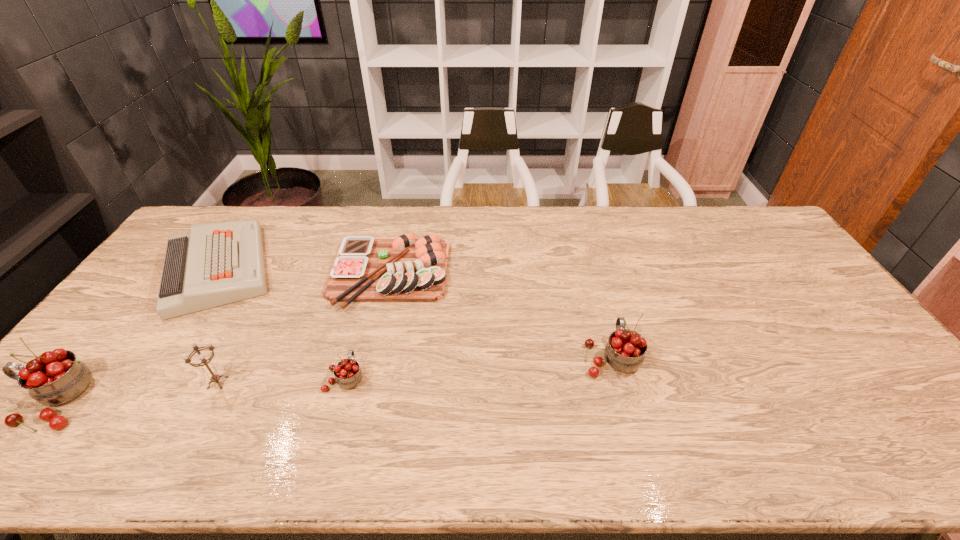
I want to click on free space that is in between the candle holder and the platter, so click(x=304, y=328).

The image size is (960, 540). In order to click on free area in between the shortest cherry and the rightmost object in this screenshot , I will do `click(478, 367)`.

Find the location of a particular element. Image resolution: width=960 pixels, height=540 pixels. unoccupied area between the candle holder and the computer keyboard is located at coordinates (218, 326).

You are a GUI agent. You are given a task and a screenshot of the screen. Output one action in this format:
    pyautogui.click(x=<x>, y=<y>)
    Task: Click on the vacant region between the third shortest object and the computer keyboard
    This screenshot has width=960, height=540.
    Given the screenshot: What is the action you would take?
    pyautogui.click(x=281, y=323)

Locate which object is the second closest to the second shortest cherry. Please provide its 2D coordinates. Your answer should be formatted as a tuple, i.e. [(x, y)], where the tuple contains the x and y coordinates of a point satisfying the conditions above.

[(348, 374)]

This screenshot has height=540, width=960. In order to click on object that stands as the fourth closest to the rightmost cherry in this screenshot , I will do `click(214, 264)`.

Point out which cherry is positioned as the nearest to the rightmost cherry. Please provide its 2D coordinates. Your answer should be formatted as a tuple, i.e. [(x, y)], where the tuple contains the x and y coordinates of a point satisfying the conditions above.

[(348, 374)]

Choose which cherry is the second nearest neighbor to the platter. Please provide its 2D coordinates. Your answer should be formatted as a tuple, i.e. [(x, y)], where the tuple contains the x and y coordinates of a point satisfying the conditions above.

[(625, 350)]

This screenshot has height=540, width=960. Find the location of `free location that satisfies the following two spatial constraints: 1. on the back side of the platter; 2. on the right side of the candle holder`. free location that satisfies the following two spatial constraints: 1. on the back side of the platter; 2. on the right side of the candle holder is located at coordinates (275, 273).

You are a GUI agent. You are given a task and a screenshot of the screen. Output one action in this format:
    pyautogui.click(x=<x>, y=<y>)
    Task: Click on the vacant space that satisfies the following two spatial constraints: 1. on the front side of the platter; 2. on the right side of the computer keyboard
    The height and width of the screenshot is (540, 960).
    Given the screenshot: What is the action you would take?
    pyautogui.click(x=214, y=273)